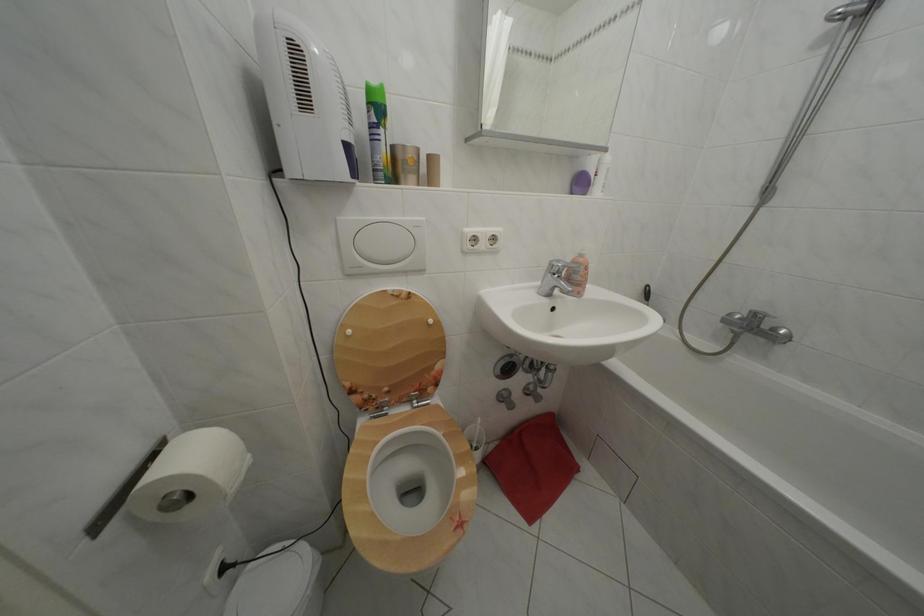
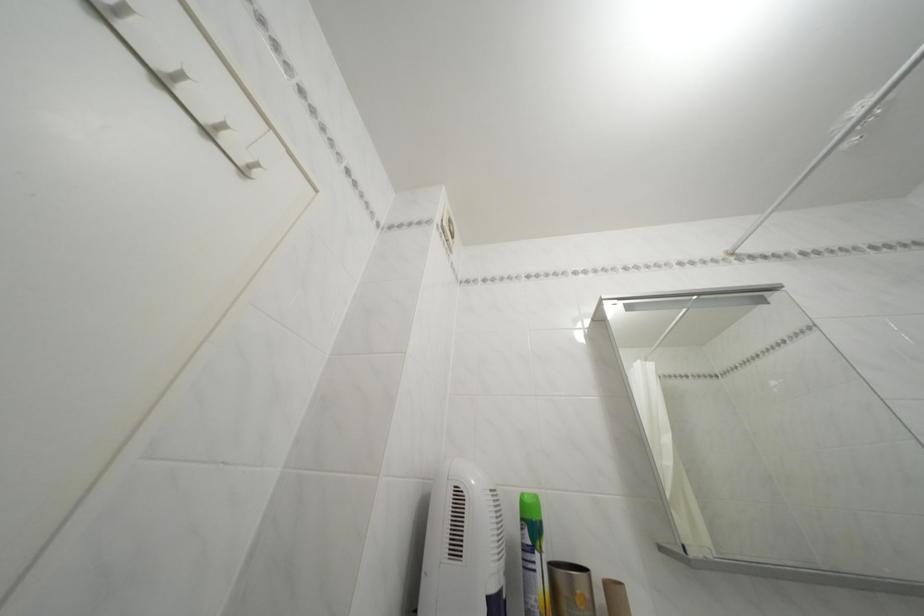
The point at (378, 110) is marked in the first image. Where is the corresponding point in the second image?

(531, 525)